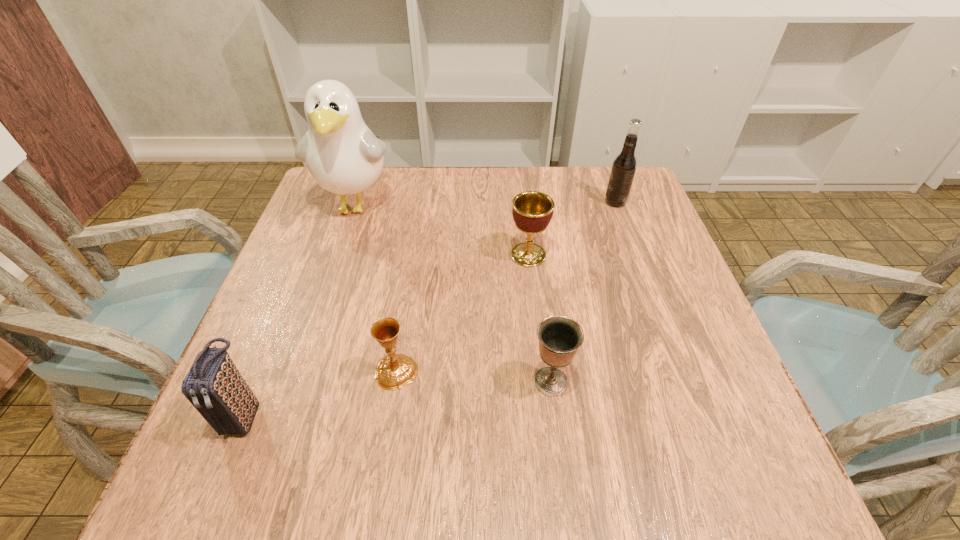
Image resolution: width=960 pixels, height=540 pixels. What are the coordinates of `free spot between the tallest object and the leftmost chalice` in the screenshot? It's located at point(376,288).

Where is `unoccupied area between the leftmost chalice and the clutch bag`? Image resolution: width=960 pixels, height=540 pixels. unoccupied area between the leftmost chalice and the clutch bag is located at coordinates (321, 393).

At what (x,y) coordinates should I click in order to perform the action: click on free space between the farthest chalice and the second tallest object. Please return your answer as a coordinate pair (x, y). The image size is (960, 540). Looking at the image, I should click on (572, 228).

Locate which object ranks third in proximity to the fifth shortest object. Please provide its 2D coordinates. Your answer should be formatted as a tuple, i.e. [(x, y)], where the tuple contains the x and y coordinates of a point satisfying the conditions above.

[(343, 156)]

You are a GUI agent. You are given a task and a screenshot of the screen. Output one action in this format:
    pyautogui.click(x=<x>, y=<y>)
    Task: Click on the object that ranks as the third closest to the fourth nearest object
    The image size is (960, 540).
    Given the screenshot: What is the action you would take?
    pyautogui.click(x=343, y=156)

Locate an element on the screen. The image size is (960, 540). the third closest chalice to the root beer is located at coordinates (395, 371).

Locate which chalice ranks in proximity to the fourth object from right to left. Please provide its 2D coordinates. Your answer should be formatted as a tuple, i.e. [(x, y)], where the tuple contains the x and y coordinates of a point satisfying the conditions above.

[(559, 337)]

Locate an element on the screen. blank area in the image that satisfies the following two spatial constraints: 1. on the label of the rightmost object; 2. on the beak of the gull is located at coordinates (616, 206).

The width and height of the screenshot is (960, 540). I want to click on free point that satisfies the following two spatial constraints: 1. on the label of the fifth shortest object; 2. on the beak of the tallest object, so click(616, 206).

I want to click on vacant area that satisfies the following two spatial constraints: 1. on the label of the rightmost object; 2. on the front side of the fourth nearest object, so click(635, 255).